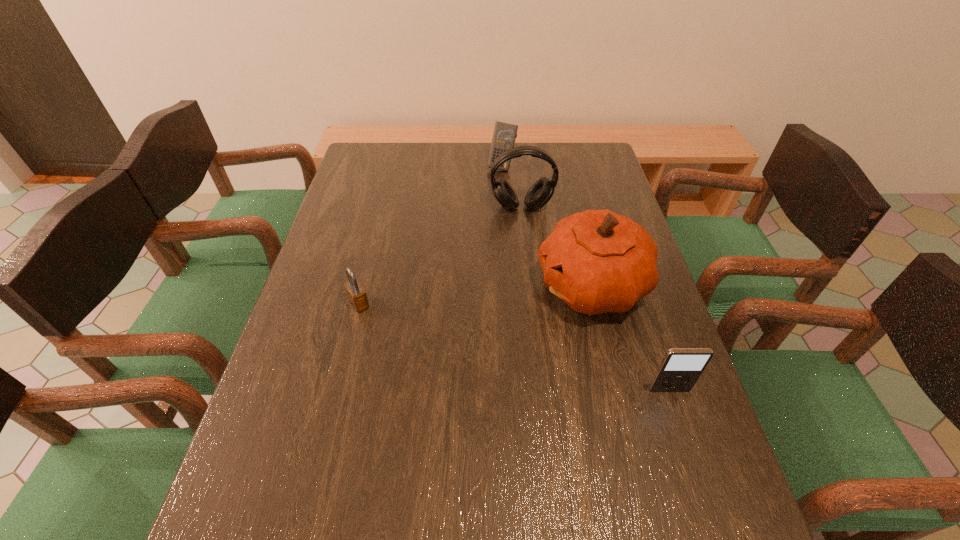
Where is `free point between the shortest object and the pumpkin`? free point between the shortest object and the pumpkin is located at coordinates (476, 295).

Locate an element on the screen. The height and width of the screenshot is (540, 960). empty location between the fourth nearest object and the calculator is located at coordinates (512, 187).

You are a GUI agent. You are given a task and a screenshot of the screen. Output one action in this format:
    pyautogui.click(x=<x>, y=<y>)
    Task: Click on the free space between the shortest object and the calculator
    Image resolution: width=960 pixels, height=540 pixels.
    Given the screenshot: What is the action you would take?
    pyautogui.click(x=430, y=235)

This screenshot has width=960, height=540. Identify the location of free space between the padlock and the iPod. tap(515, 347).

The height and width of the screenshot is (540, 960). I want to click on object that is the fourth closest to the iPod, so click(504, 135).

Locate an element on the screen. Image resolution: width=960 pixels, height=540 pixels. object that is the closest one to the pumpkin is located at coordinates (680, 369).

This screenshot has height=540, width=960. I want to click on free space that satisfies the following two spatial constraints: 1. on the front side of the farthest object; 2. on the left side of the headset, so click(504, 207).